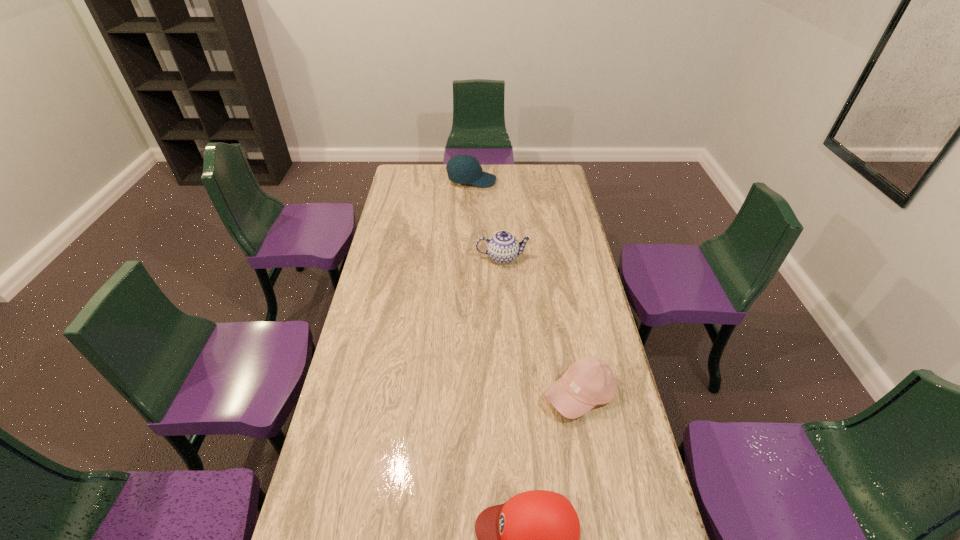
Locate an element on the screen. The image size is (960, 540). the farthest baseball cap is located at coordinates (463, 169).

Where is `the farthest object`? Image resolution: width=960 pixels, height=540 pixels. the farthest object is located at coordinates point(463,169).

I want to click on chinaware, so click(x=503, y=247).

What are the coordinates of `the third farthest object` in the screenshot? It's located at (589, 381).

Locate an element on the screen. vacant space situated on the front-facing side of the farthest object is located at coordinates (534, 181).

Identify the location of vacant space located at the spout of the third nearest object. (505, 294).

You are a GUI agent. You are given a task and a screenshot of the screen. Output one action in this format:
    pyautogui.click(x=<x>, y=<y>)
    Task: Click on the free space located 0.240m on the front-facing side of the second farthest baseball cap
    The width and height of the screenshot is (960, 540).
    Given the screenshot: What is the action you would take?
    pyautogui.click(x=602, y=510)

Locate an element on the screen. object at the far edge is located at coordinates (463, 169).

You are a GUI agent. You are given a task and a screenshot of the screen. Output one action in this format:
    pyautogui.click(x=<x>, y=<y>)
    Task: Click on the object situated at the right edge
    The width and height of the screenshot is (960, 540).
    Given the screenshot: What is the action you would take?
    pyautogui.click(x=589, y=381)

In the image, there is a desktop. Where is `vacant region at the left edge`? vacant region at the left edge is located at coordinates (372, 294).